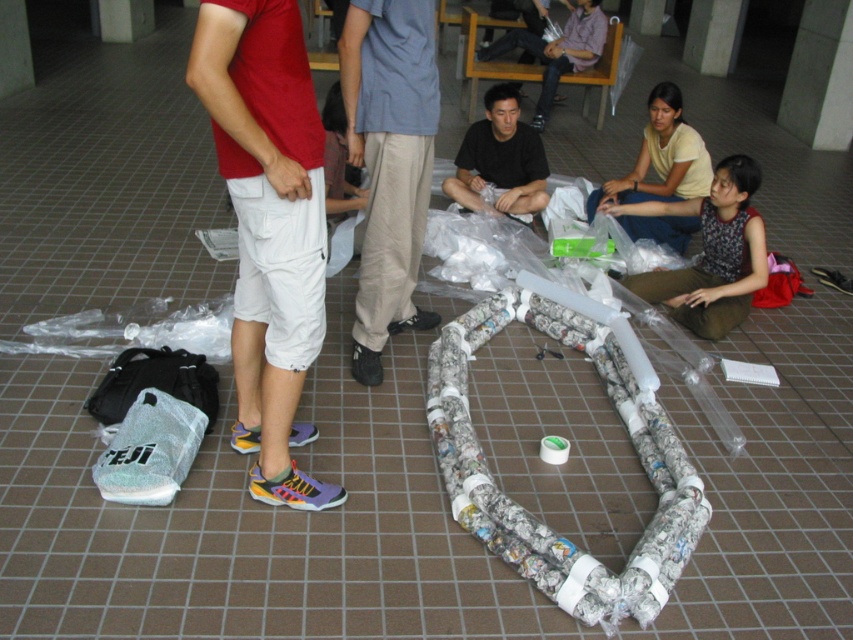
You are organizing a clothing donation drive and need to place the patterned fabric shirt at lower right and the light yellow cotton shirt at upper right into boxes. The boxes are 18 inches wide. Can both shirts fit side by side in the same box without overlapping?

The patterned fabric shirt at lower right and light yellow cotton shirt at upper right are 18.22 inches apart, so they cannot fit side by side in an 18 inch wide box without overlapping.

You are standing in the corridor and want to move from point A to point B. The points are labeled as point (291, 240) and point (663, 204). Which point should you start from to reach the other point with fewer steps?

You should start from point (663, 204) to reach point (291, 240) with fewer steps since point (291, 240) is closer to the viewer and thus physically nearer in the corridor.

You are a fashion designer observing the scene. You need to determine which item of clothing is more suitable for a casual summer outfit between the white cotton shorts at center and the black matte shirt at center. Based on their sizes, which one would you choose?

The white cotton shorts at center is larger in size than the black matte shirt at center, making it more suitable for a casual summer outfit as larger shorts can be more comfortable in warm weather.